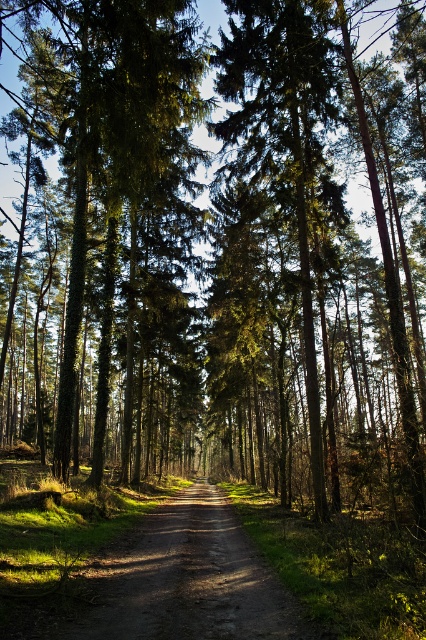
You are standing at the point marked in the forest scene. The coordinates are given as point (140, 276). If you want to walk towards the direction where the trees are denser, which direction should you move relative to your current position?

The point (140, 276) is 23.17 meters away from the viewer. Since the trees on both sides of the path are described as tall and dense, moving either left or right along the path would lead towards areas with denser trees. However, without additional directional cues, it is safest to follow the path itself, which is flanked by dense trees on both sides.

You are a hiker walking along the dirt road at center and want to reach the green textured tree at center. Which direction should you move to get closer to the tree?

The green textured tree at center is further to the viewer than the dirt road at center, so you should move forward along the dirt road at center towards the tree to get closer.